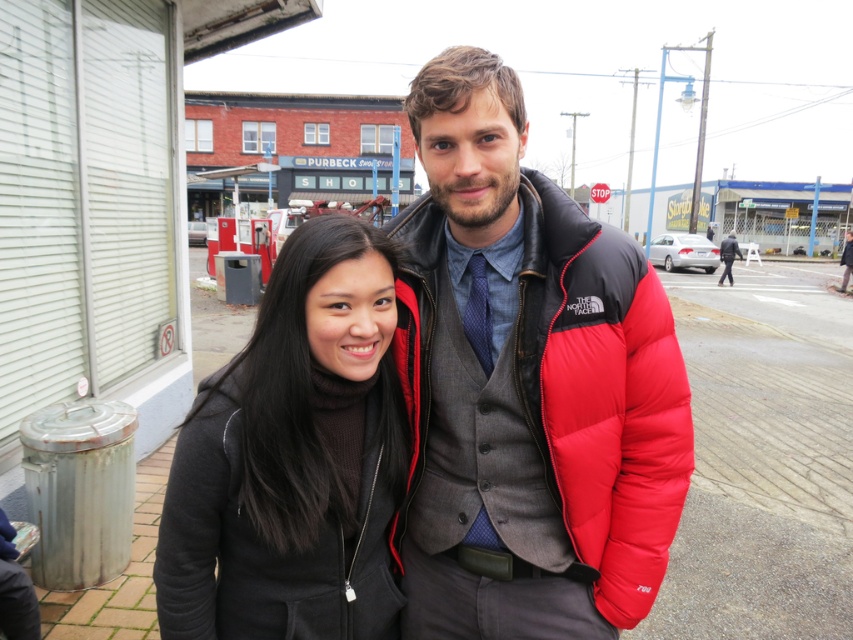
In the scene shown: You are a photographer trying to adjust the lighting for a photo of the black matte jacket at center. You need to place a reflector at the point where the jacket is located, which is at point (291, 461). Can you confirm the coordinates of the black matte jacket at center?

The black matte jacket at center is located at point (291, 461).

Consider the image. You are a fashion designer observing the two jackets in the image. Which jacket is smaller in size between the black matte jacket at center and the dark gray wool coat at center?

The black matte jacket at center is smaller in size compared to the dark gray wool coat at center.